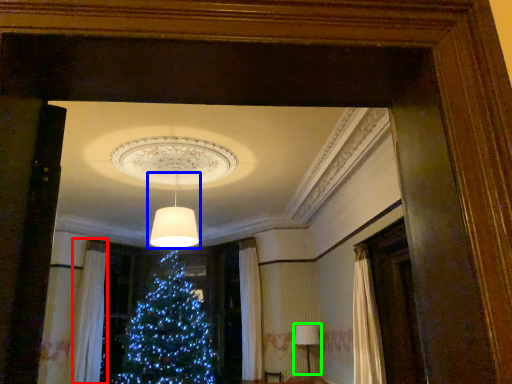
Question: Estimate the real-world distances between objects in this image. Which object is closer to curtain (highlighted by a red box), lamp (highlighted by a blue box) or lamp (highlighted by a green box)?

Choices:
 (A) lamp
 (B) lamp

Answer: (A)